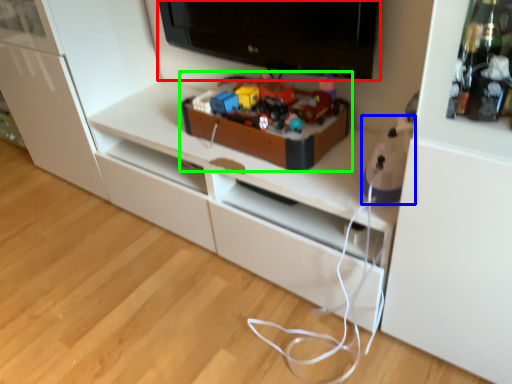
Question: Estimate the real-world distances between objects in this image. Which object is closer to television (highlighted by a red box), toy (highlighted by a blue box) or toy (highlighted by a green box)?

Choices:
 (A) toy
 (B) toy

Answer: (B)